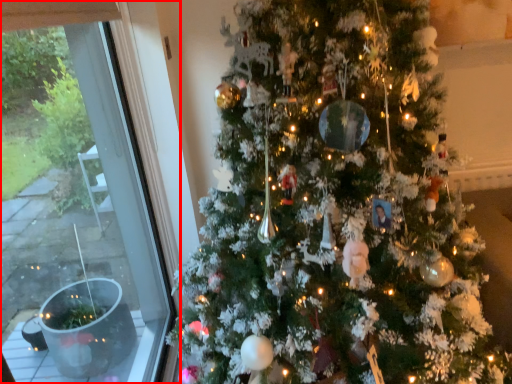
Question: From the image's perspective, what is the correct spatial relationship of window (annotated by the red box) in relation to christmas tree?

Choices:
 (A) above
 (B) below

Answer: (B)